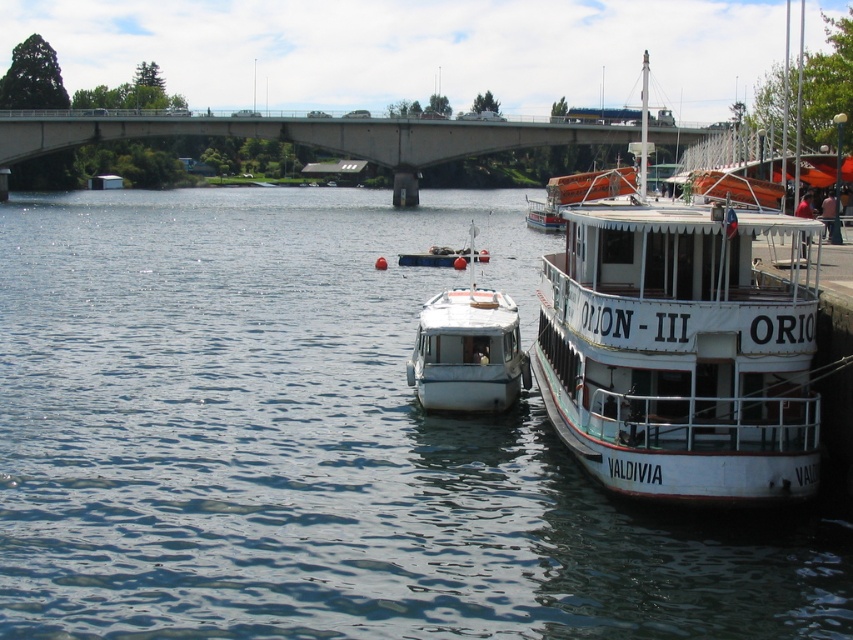
You are a photographer planning to take a photo of the orange rubber lifeboat at upper right and the concrete bridge at upper center. Which object should you focus on first if you want to capture both in the same frame without moving the camera?

You should focus on the concrete bridge at upper center first because the orange rubber lifeboat at upper right is behind it, so adjusting focus to the bridge will ensure both are in the frame.

Based on the photo, you are standing on the pier and want to board the white wooden boat at right. Which direction should you walk relative to the concrete bridge at upper center?

You should walk to the right relative to the concrete bridge at upper center to reach the white wooden boat at right.